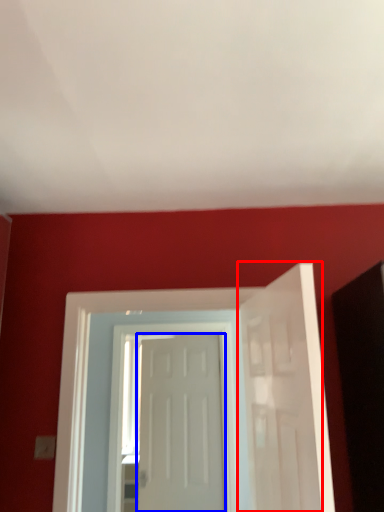
Question: Which point is further to the camera, door (highlighted by a red box) or door (highlighted by a blue box)?

Choices:
 (A) door
 (B) door

Answer: (B)